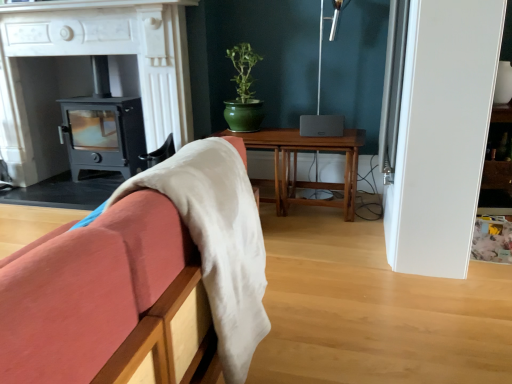
Image resolution: width=512 pixels, height=384 pixels. Describe the element at coordinates (103, 128) in the screenshot. I see `matte black wood burning stove at left` at that location.

The width and height of the screenshot is (512, 384). I want to click on wooden table at center, so point(296,165).

Measure the distance between wooden sofa at left and camera.

wooden sofa at left and camera are 18.15 inches apart.

In order to click on white marble fireplace at center in this screenshot , I will do `click(87, 72)`.

Relative to matte black wood burning stove at left, is wooden table at center in front or behind?

wooden table at center is in front of matte black wood burning stove at left.

Does wooden table at center have a larger size compared to matte black wood burning stove at left?

Correct, wooden table at center is larger in size than matte black wood burning stove at left.

Between wooden table at center and matte black wood burning stove at left, which one has more height?

With more height is matte black wood burning stove at left.

Considering the sizes of objects wooden sofa at left and white marble fireplace at center in the image provided, who is taller, wooden sofa at left or white marble fireplace at center?

white marble fireplace at center.

Based on the photo, visually, is wooden sofa at left positioned to the left or to the right of white marble fireplace at center?

wooden sofa at left is to the right of white marble fireplace at center.

Considering the sizes of objects wooden sofa at left and wooden table at center in the image provided, who is shorter, wooden sofa at left or wooden table at center?

Standing shorter between the two is wooden table at center.

Is wooden sofa at left surrounding wooden table at center?

No, wooden table at center is located outside of wooden sofa at left.

Considering the sizes of objects wooden sofa at left and wooden table at center in the image provided, who is bigger, wooden sofa at left or wooden table at center?

With larger size is wooden table at center.

Based on their positions, is white marble fireplace at center located to the left or right of matte black wood burning stove at left?

In the image, white marble fireplace at center appears on the left side of matte black wood burning stove at left.

Which object is thinner, white marble fireplace at center or matte black wood burning stove at left?

matte black wood burning stove at left.

Does point (6, 10) lie in front of point (97, 164)?

Yes, it is.

From the image's perspective, is white marble fireplace at center on top of wooden table at center?

Indeed, from the image's perspective, white marble fireplace at center is shown above wooden table at center.

Is white marble fireplace at center not near wooden table at center?

white marble fireplace at center is far away from wooden table at center.

At what (x,y) coordinates should I click in order to perform the action: click on table that appears behind the white marble fireplace at center. Please return your answer as a coordinate pair (x, y). Image resolution: width=512 pixels, height=384 pixels. Looking at the image, I should click on (296, 165).

Between point (67, 20) and point (354, 173), which one is positioned in front?

The point (354, 173) is in front.

Which object is further away from the camera taking this photo, matte black wood burning stove at left or wooden sofa at left?

matte black wood burning stove at left is further away from the camera.

Could you tell me if matte black wood burning stove at left is facing wooden sofa at left?

No, matte black wood burning stove at left is not oriented towards wooden sofa at left.

Considering the sizes of objects matte black wood burning stove at left and wooden sofa at left in the image provided, who is wider, matte black wood burning stove at left or wooden sofa at left?

wooden sofa at left.

Is matte black wood burning stove at left at the left side of wooden sofa at left?

Correct, you'll find matte black wood burning stove at left to the left of wooden sofa at left.

Can you see matte black wood burning stove at left touching white marble fireplace at center?

matte black wood burning stove at left and white marble fireplace at center are not in contact.

Is white marble fireplace at center at the back of matte black wood burning stove at left?

Yes.

Is white marble fireplace at center inside matte black wood burning stove at left?

No, white marble fireplace at center is located outside of matte black wood burning stove at left.

Find the location of a particular element. fireplace that is in front of the matte black wood burning stove at left is located at coordinates (87, 72).

Identify the location of wood burning stove located above the wooden table at center (from a real-world perspective). The image size is (512, 384). (103, 128).

In order to click on furniture below the white marble fireplace at center (from the image's perspective) in this screenshot , I will do `click(98, 293)`.

In the scene shown: When comparing their distances from matte black wood burning stove at left, does wooden sofa at left or white marble fireplace at center seem further?

wooden sofa at left lies further to matte black wood burning stove at left than the other object.

When comparing their distances from white marble fireplace at center, does wooden sofa at left or matte black wood burning stove at left seem further?

wooden sofa at left is further to white marble fireplace at center.

When comparing their distances from wooden sofa at left, does wooden table at center or matte black wood burning stove at left seem further?

matte black wood burning stove at left.

From the image, which object appears to be nearer to white marble fireplace at center, matte black wood burning stove at left or wooden table at center?

The object closer to white marble fireplace at center is matte black wood burning stove at left.

Estimate the real-world distances between objects in this image. Which object is closer to wooden table at center, matte black wood burning stove at left or white marble fireplace at center?

white marble fireplace at center is closer to wooden table at center.

Looking at the image, which one is located further to matte black wood burning stove at left, white marble fireplace at center or wooden table at center?

wooden table at center lies further to matte black wood burning stove at left than the other object.

From the picture: Which object lies further to the anchor point wooden sofa at left, wooden table at center or white marble fireplace at center?

white marble fireplace at center.

Looking at the image, which one is located further to white marble fireplace at center, wooden table at center or matte black wood burning stove at left?

wooden table at center lies further to white marble fireplace at center than the other object.

At what (x,y) coordinates should I click in order to perform the action: click on fireplace positioned between wooden sofa at left and matte black wood burning stove at left from near to far. Please return your answer as a coordinate pair (x, y). Looking at the image, I should click on (87, 72).

I want to click on wood burning stove between white marble fireplace at center and wooden table at center from left to right, so click(x=103, y=128).

The height and width of the screenshot is (384, 512). In order to click on table between wooden sofa at left and matte black wood burning stove at left in the front-back direction in this screenshot , I will do `click(296, 165)`.

Find the location of `fireplace between wooden sofa at left and wooden table at center along the z-axis`. fireplace between wooden sofa at left and wooden table at center along the z-axis is located at coordinates (87, 72).